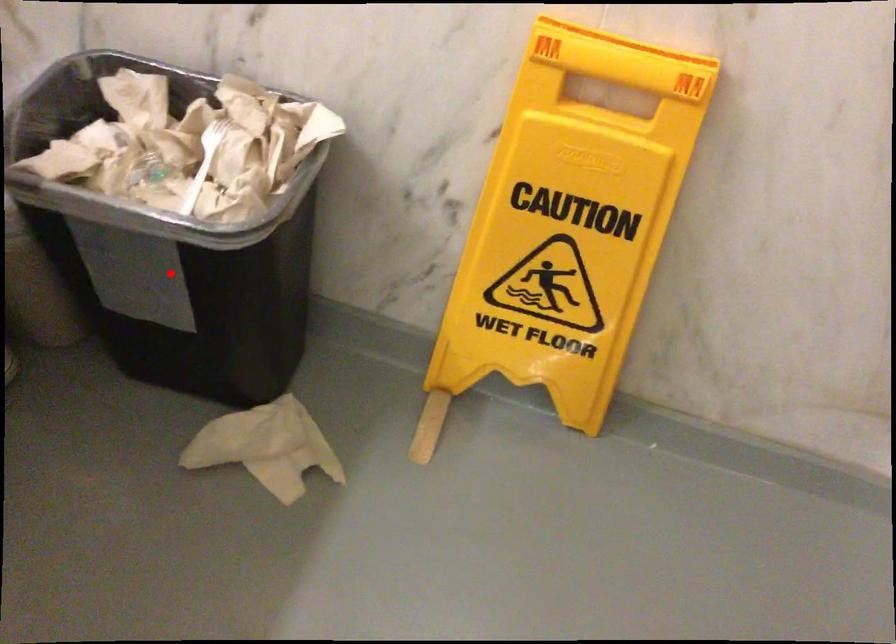
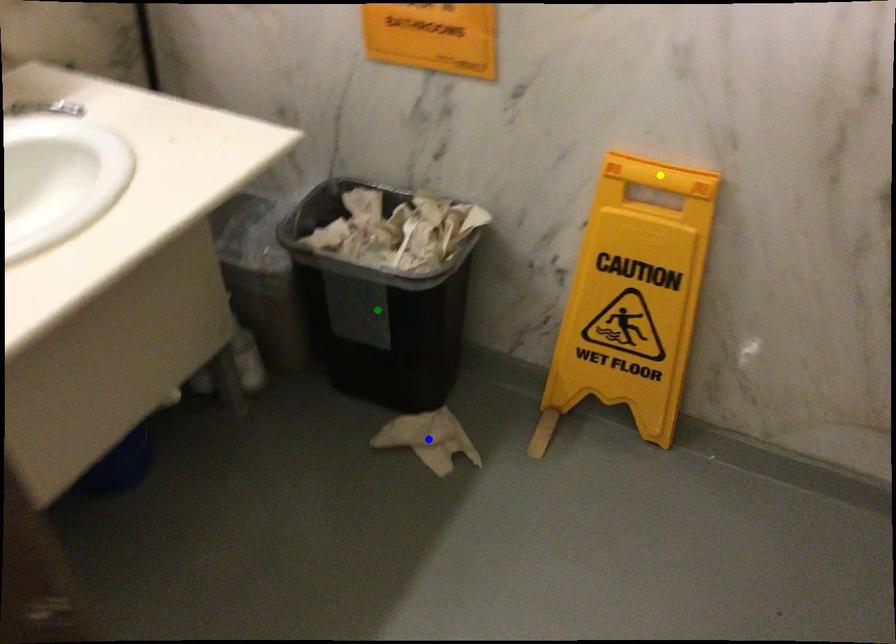
Question: I am providing you with two images of the same scene from different viewpoints. A red point is marked on the first image. You are given multiple points on the second image. Which spot in image 2 lines up with the point in image 1?

Choices:
 (A) yellow point
 (B) blue point
 (C) green point

Answer: (C)